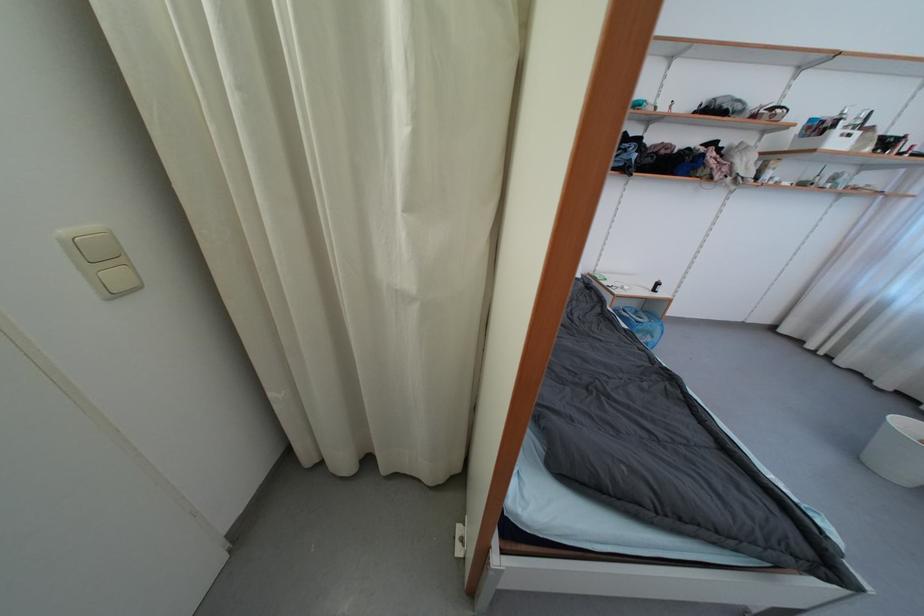
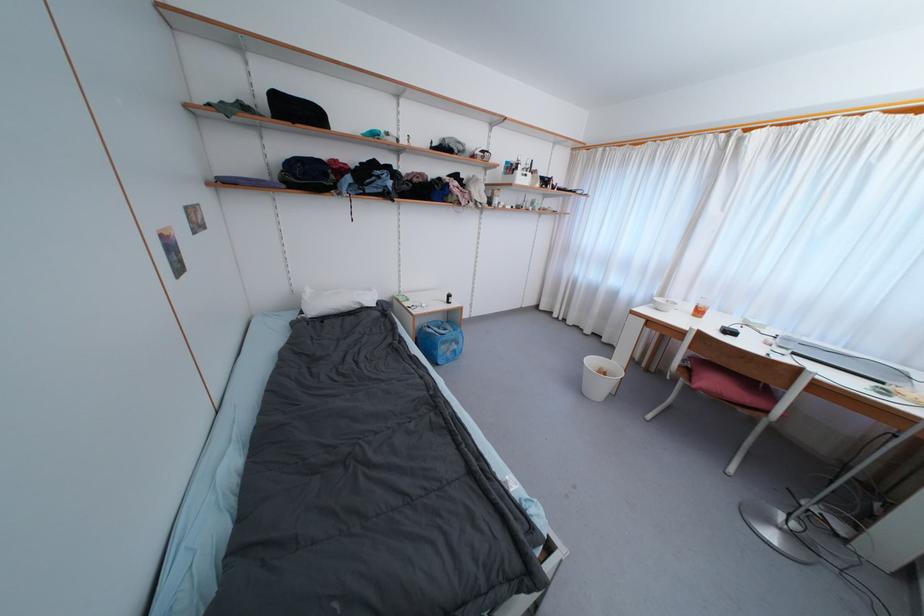
Question: How did the camera likely rotate?

Choices:
 (A) Left
 (B) Right
 (C) Up
 (D) Down

Answer: (B)